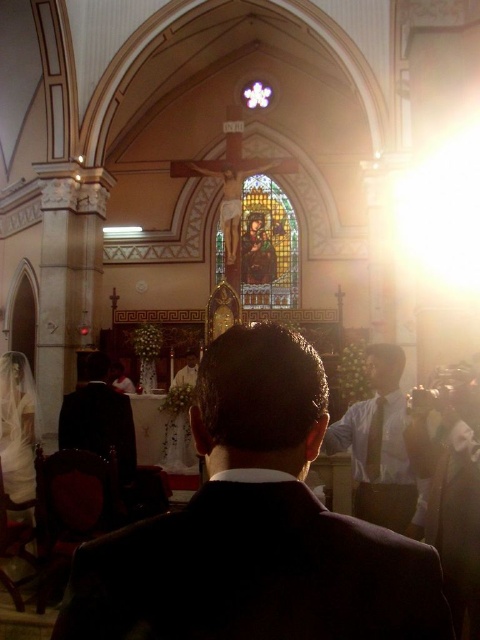
Question: Which point is farther to the camera?

Choices:
 (A) dark suit at center
 (B) white shirt at center

Answer: (B)

Question: Which of the following is the farthest from the observer?

Choices:
 (A) (276, 218)
 (B) (359, 429)
 (C) (299, 608)
 (D) (97, 388)

Answer: (A)

Question: Considering the real-world distances, which object is farthest from the black suit at left?

Choices:
 (A) white shirt at center
 (B) stained glass window at center
 (C) dark suit at center

Answer: (B)

Question: Does dark suit at center lie in front of stained glass window at center?

Choices:
 (A) yes
 (B) no

Answer: (A)

Question: Observing the image, what is the correct spatial positioning of dark suit at center in reference to black suit at left?

Choices:
 (A) below
 (B) above

Answer: (B)

Question: Is dark suit at center smaller than black suit at left?

Choices:
 (A) no
 (B) yes

Answer: (B)